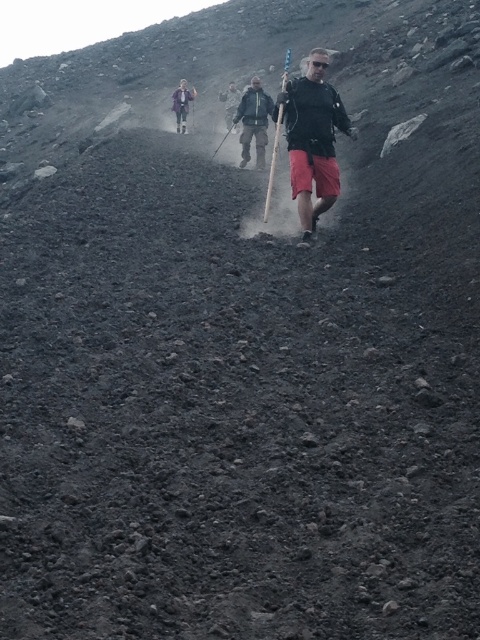
You are a hiker trying to locate two hikers wearing jackets. You see the dark gray jacket at center and the matte gray jacket at upper center. Which hiker is standing closer to the top of the hill?

The matte gray jacket at upper center is closer to the top of the hill because it is positioned higher up on the slope compared to the dark gray jacket at center, which is lower down.

You are a hiker trying to decide which jacket to wear for the steep terrain. The dark gray jacket at center is currently being worn by someone on the path. The matte gray jacket at upper center is worn by someone further up the slope. Based on their visibility, which jacket might be more visible to others on the trail?

The matte gray jacket at upper center is wider than the dark gray jacket at center, making it more visible to others on the trail.

From the picture: You are a hiker on the steep hillside. You notice two hikers ahead wearing jackets. One has a matte black jacket at center and the other has a dark gray jacket at center. Which jacket is more to the right?

The matte black jacket at center is positioned on the right side of dark gray jacket at center, so the matte black jacket at center is more to the right.